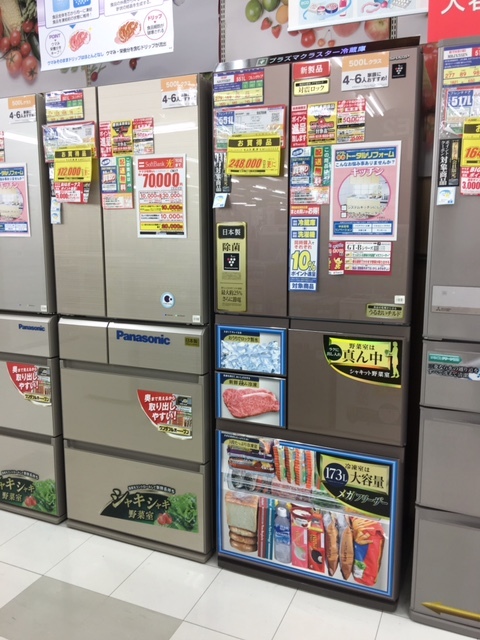
I want to click on veggie drawer, so click(21, 452), click(88, 458), click(436, 541), click(313, 480).